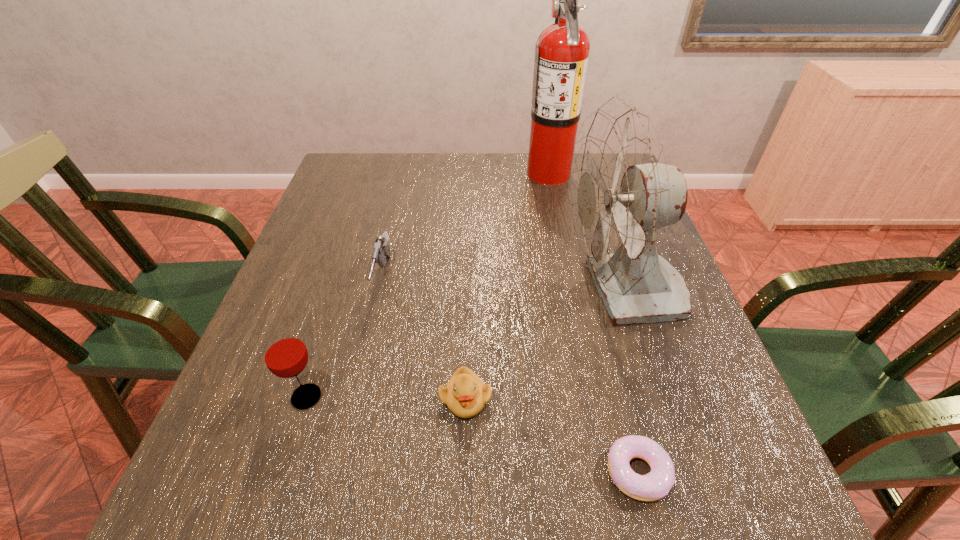
In the image, there is a desktop. Identify the location of vacant space at the far left corner. tap(376, 158).

Image resolution: width=960 pixels, height=540 pixels. What are the coordinates of `free space at the near right corner` in the screenshot? It's located at (698, 515).

Image resolution: width=960 pixels, height=540 pixels. I want to click on free space that is in between the gun and the tallest object, so click(x=466, y=226).

Where is `free space between the second shortest object and the tallest object`? This screenshot has width=960, height=540. free space between the second shortest object and the tallest object is located at coordinates (507, 285).

Image resolution: width=960 pixels, height=540 pixels. Find the location of `free space that is in between the fourth shortest object and the doughnut`. free space that is in between the fourth shortest object and the doughnut is located at coordinates (472, 434).

The height and width of the screenshot is (540, 960). I want to click on free point between the fourth shortest object and the fifth object from right to left, so click(x=345, y=338).

Locate an element on the screen. vacant point located between the fourth object from right to left and the tallest object is located at coordinates (507, 285).

Image resolution: width=960 pixels, height=540 pixels. What are the coordinates of `free space between the fifth object from right to left and the third tallest object` in the screenshot? It's located at (345, 338).

This screenshot has width=960, height=540. I want to click on vacant point located between the tallest object and the doughnut, so click(593, 322).

Where is `free space between the fourth shortest object and the nearest object`? free space between the fourth shortest object and the nearest object is located at coordinates (472, 434).